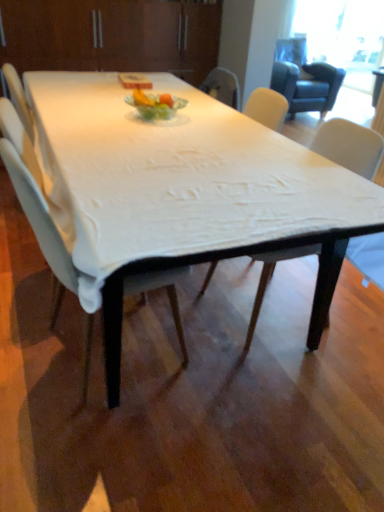
This screenshot has width=384, height=512. What are the coordinates of `free space in front of white fabric chair at center, arranged as the 1th chair when viewed from the left` in the screenshot? It's located at (104, 443).